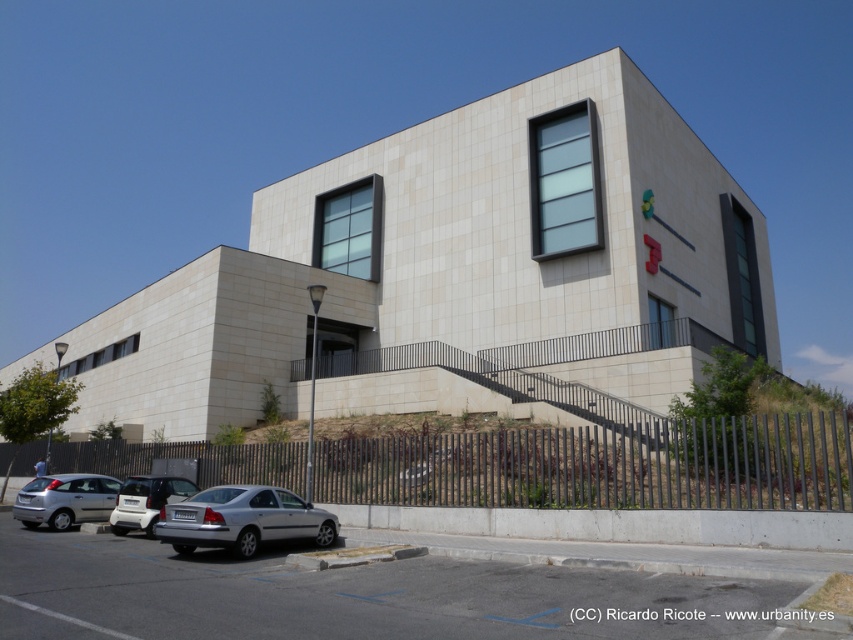
Question: Can you confirm if metallic gray fence at lower center is positioned to the left of silver metallic car at lower left?

Choices:
 (A) yes
 (B) no

Answer: (A)

Question: In this image, where is metallic gray fence at lower center located relative to silver metallic car at lower center?

Choices:
 (A) left
 (B) right

Answer: (A)

Question: Does silver metallic hatchback at lower left appear on the right side of silver metallic car at lower left?

Choices:
 (A) no
 (B) yes

Answer: (A)

Question: Which object appears farthest from the camera in this image?

Choices:
 (A) silver metallic hatchback at lower left
 (B) gray asphalt parking lot at lower center
 (C) silver metallic car at lower center
 (D) metallic gray fence at lower center

Answer: (A)

Question: Estimate the real-world distances between objects in this image. Which object is farther from the silver metallic hatchback at lower left?

Choices:
 (A) silver metallic car at lower center
 (B) silver metallic car at lower left

Answer: (A)

Question: Which point is closer to the camera taking this photo?

Choices:
 (A) (264, 512)
 (B) (186, 490)
 (C) (88, 493)

Answer: (A)